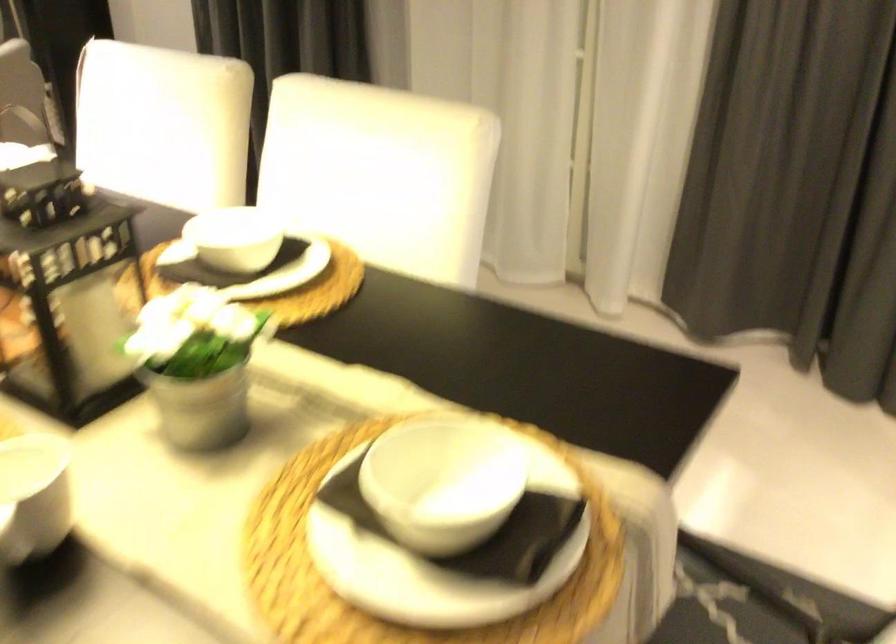
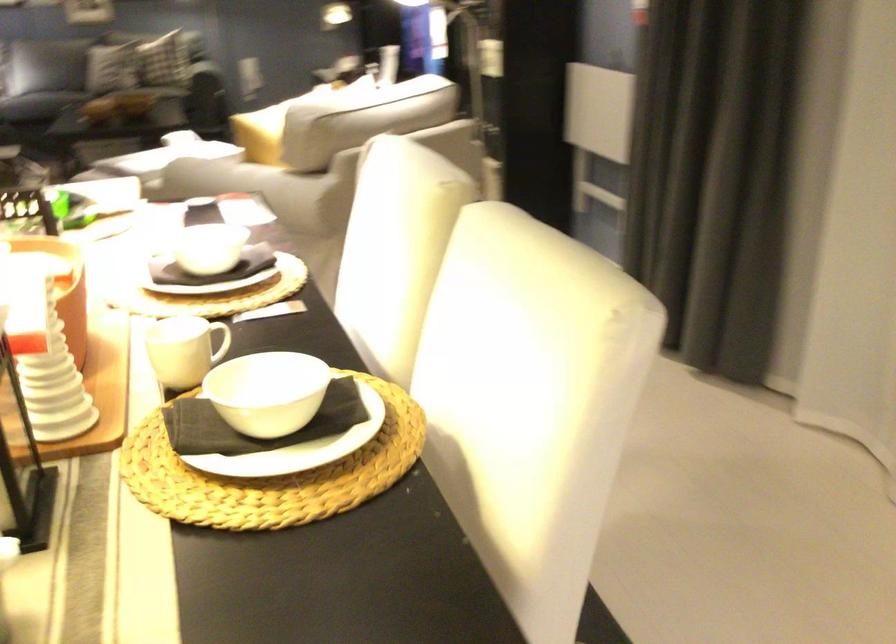
The point at (218, 247) is marked in the first image. Where is the corresponding point in the second image?

(268, 392)